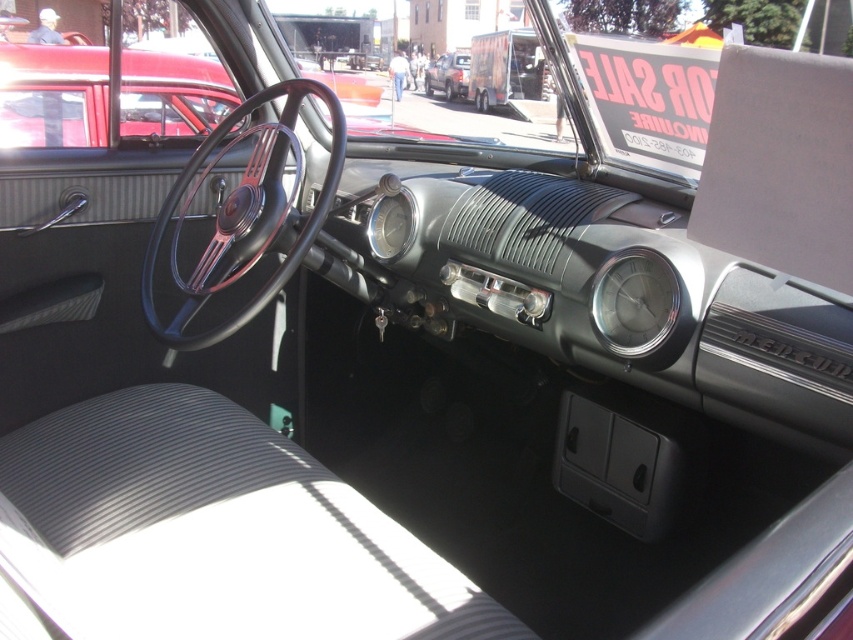
Question: Which point appears farthest from the camera in this image?

Choices:
 (A) [245, 253]
 (B) [653, 269]

Answer: (A)

Question: Which point appears closest to the camera in this image?

Choices:
 (A) (624, 321)
 (B) (338, 161)
 (C) (434, 86)

Answer: (A)

Question: Where is black leather steering wheel at center located in relation to matte black truck at center in the image?

Choices:
 (A) right
 (B) left

Answer: (B)

Question: Is black leather steering wheel at center wider than metallic silver clock at center?

Choices:
 (A) no
 (B) yes

Answer: (B)

Question: Does black leather steering wheel at center have a lesser width compared to metallic silver clock at center?

Choices:
 (A) yes
 (B) no

Answer: (B)

Question: Among these objects, which one is nearest to the camera?

Choices:
 (A) black leather steering wheel at center
 (B) matte black truck at center
 (C) metallic silver clock at center

Answer: (C)